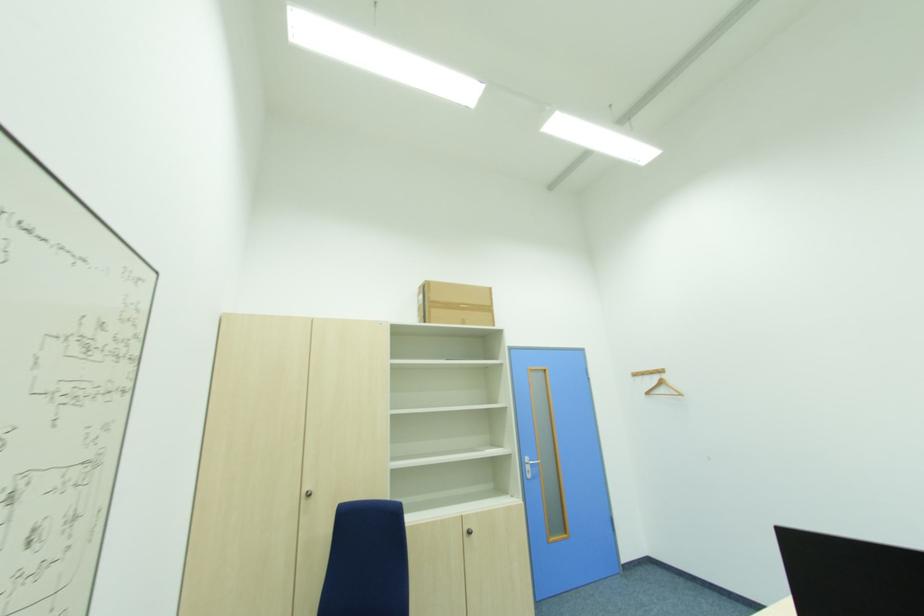
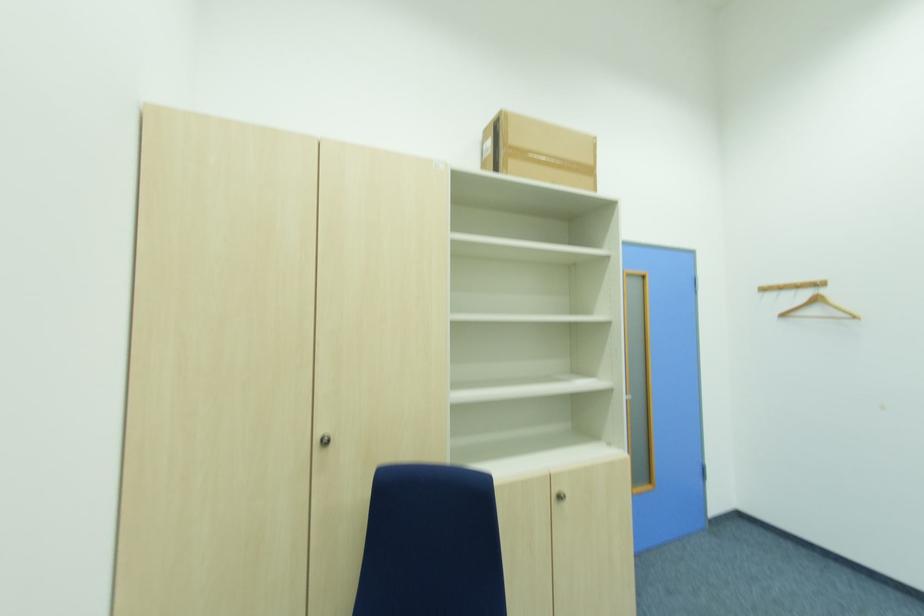
Locate, in the second image, the point that corresponds to the point at 438,302 in the first image.

(515, 150)